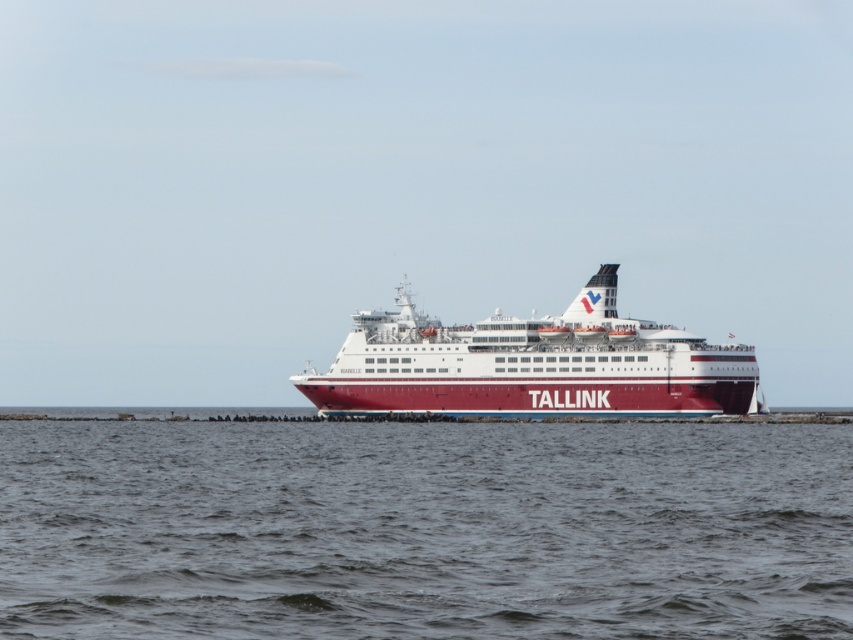
You are standing on the deck of the ferry ship and looking out at the scene. There is a point at coordinates (424, 529). What is located at that point?

The point at coordinates (424, 529) corresponds to gray water at center.

You are a photographer trying to capture the red polished ship at center in the frame. Since the gray water at center is part of the scene, will the ship take up more space in the photo than the water?

Result: The gray water at center has a smaller size compared to the red polished ship at center, so the red polished ship at center will take up more space in the photo than the gray water at center.